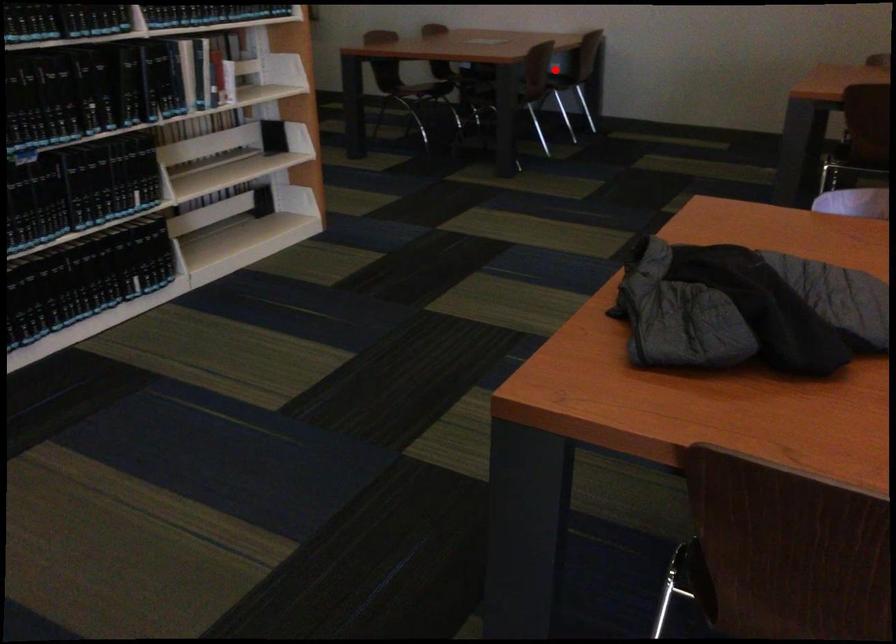
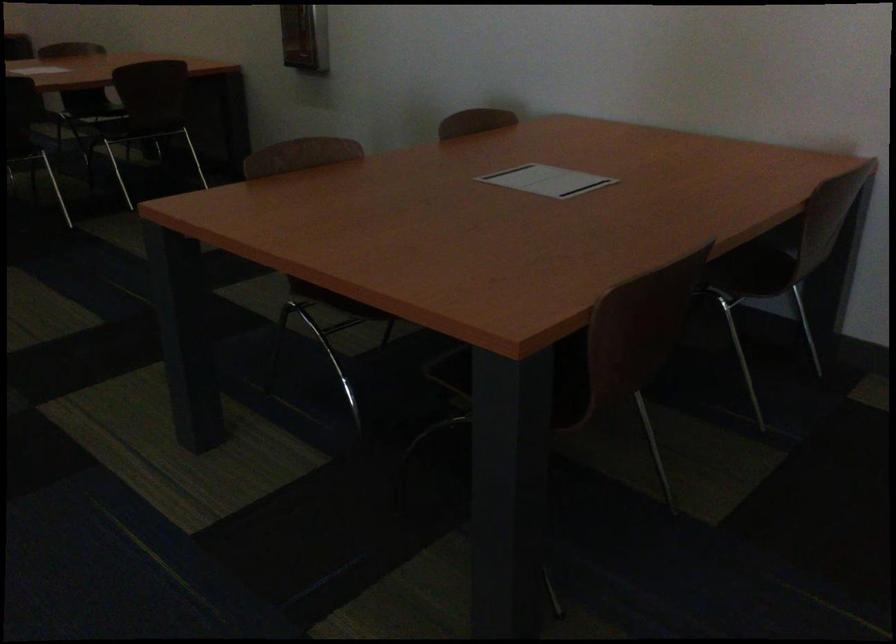
The point at the highlighted location is marked in the first image. Where is the corresponding point in the second image?

(764, 272)